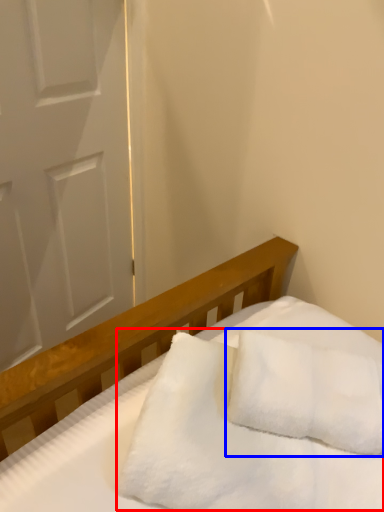
Question: Which of the following is the farthest to the observer, blanket (highlighted by a red box) or pillow (highlighted by a blue box)?

Choices:
 (A) blanket
 (B) pillow

Answer: (B)